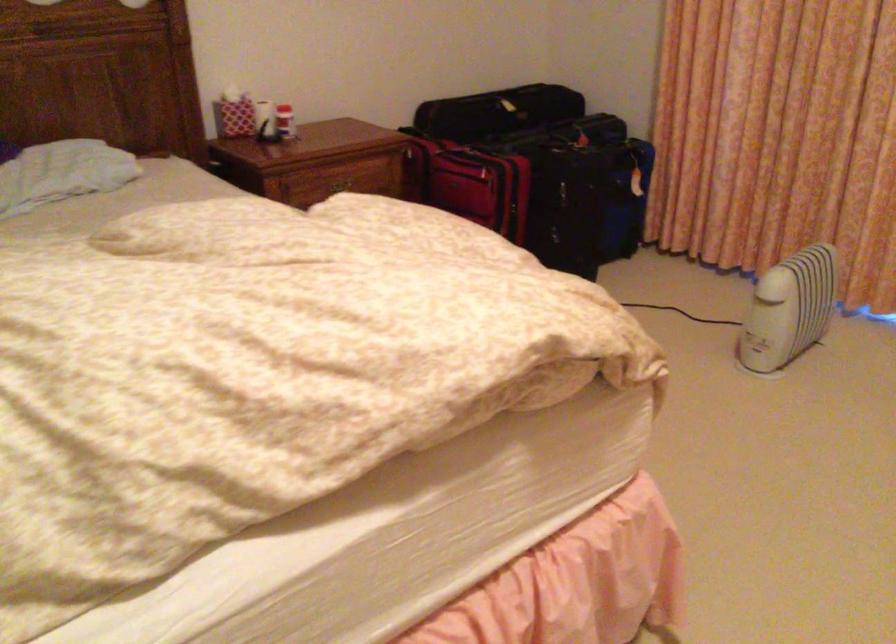
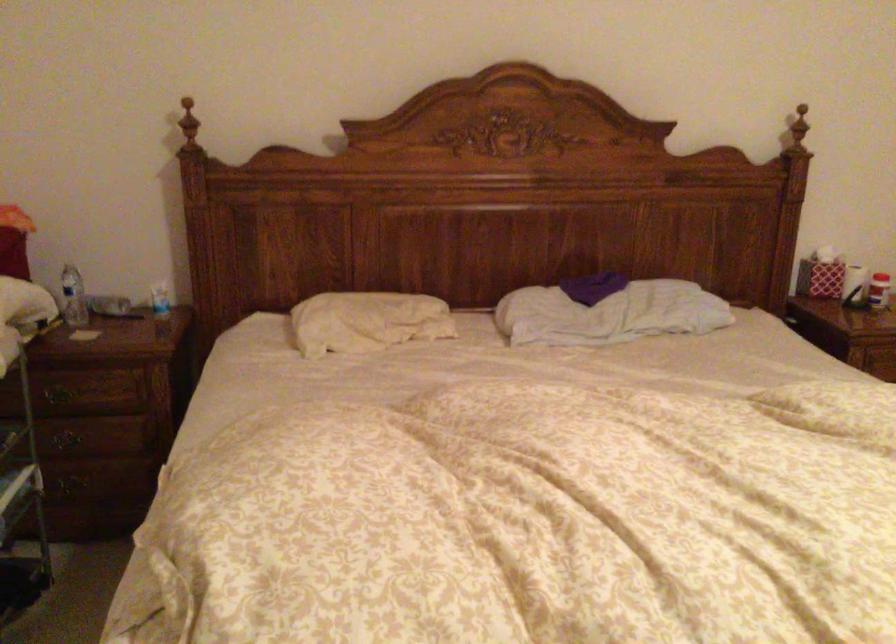
Question: The camera is either moving clockwise (left) or counter-clockwise (right) around the object. The first image is from the beginning of the video and the second image is from the end. Is the camera moving left or right when shooting the video?

Choices:
 (A) Left
 (B) Right

Answer: (B)